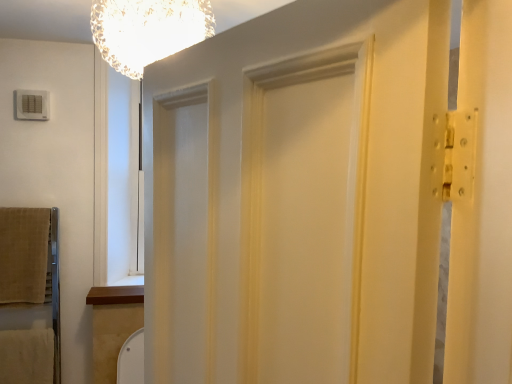
In order to click on beige soft towel at left in this screenshot , I will do `click(23, 254)`.

Where is `white painted wood barn door at center`? Image resolution: width=512 pixels, height=384 pixels. white painted wood barn door at center is located at coordinates (297, 197).

Can you confirm if beige soft towel at left is thinner than translucent glass chandelier at upper center?

Yes, beige soft towel at left is thinner than translucent glass chandelier at upper center.

Is beige soft towel at left not near translucent glass chandelier at upper center?

Absolutely, beige soft towel at left is distant from translucent glass chandelier at upper center.

What's the angular difference between beige soft towel at left and translucent glass chandelier at upper center's facing directions?

beige soft towel at left and translucent glass chandelier at upper center are facing 1.2 degrees away from each other.

From a real-world perspective, is beige soft towel at left under translucent glass chandelier at upper center?

Correct, in the physical world, beige soft towel at left is lower than translucent glass chandelier at upper center.

From a real-world perspective, is translucent glass chandelier at upper center located beneath white painted wood barn door at center?

No, from a real-world perspective, translucent glass chandelier at upper center is not beneath white painted wood barn door at center.

Considering the sizes of translucent glass chandelier at upper center and white painted wood barn door at center in the image, is translucent glass chandelier at upper center wider or thinner than white painted wood barn door at center?

Considering their sizes, translucent glass chandelier at upper center looks broader than white painted wood barn door at center.

Is translucent glass chandelier at upper center touching white painted wood barn door at center?

There is a gap between translucent glass chandelier at upper center and white painted wood barn door at center.

Considering the sizes of white painted wood barn door at center and translucent glass chandelier at upper center in the image, is white painted wood barn door at center wider or thinner than translucent glass chandelier at upper center?

Clearly, white painted wood barn door at center has less width compared to translucent glass chandelier at upper center.

From a real-world perspective, is white painted wood barn door at center on top of translucent glass chandelier at upper center?

No, from a real-world perspective, white painted wood barn door at center is not over translucent glass chandelier at upper center

From the image's perspective, which is above, white painted wood barn door at center or translucent glass chandelier at upper center?

translucent glass chandelier at upper center.

Which object is further away from the camera taking this photo, white painted wood barn door at center or translucent glass chandelier at upper center?

Positioned behind is translucent glass chandelier at upper center.

Could you tell me if translucent glass chandelier at upper center is turned towards beige soft towel at left?

No, translucent glass chandelier at upper center is not aimed at beige soft towel at left.

Between translucent glass chandelier at upper center and beige soft towel at left, which one has more height?

beige soft towel at left.

Is the depth of translucent glass chandelier at upper center less than that of beige soft towel at left?

Yes, it is in front of beige soft towel at left.

From a real-world perspective, between white painted wood barn door at center and beige soft towel at left, who is vertically higher?

From a 3D spatial view, white painted wood barn door at center is above.

Is white painted wood barn door at center in front of or behind beige soft towel at left in the image?

Clearly, white painted wood barn door at center is in front of beige soft towel at left.

From the picture: Considering the relative sizes of white painted wood barn door at center and beige soft towel at left in the image provided, is white painted wood barn door at center taller than beige soft towel at left?

Indeed, white painted wood barn door at center has a greater height compared to beige soft towel at left.

Looking at this image, are white painted wood barn door at center and beige soft towel at left far apart?

white painted wood barn door at center is far away from beige soft towel at left.

Is beige soft towel at left not within white painted wood barn door at center?

Yes, beige soft towel at left is outside of white painted wood barn door at center.

Image resolution: width=512 pixels, height=384 pixels. What are the coordinates of `barn door located in front of the beige soft towel at left` in the screenshot? It's located at (297, 197).

Is beige soft towel at left wider or thinner than white painted wood barn door at center?

Considering their sizes, beige soft towel at left looks slimmer than white painted wood barn door at center.

From a real-world perspective, is beige soft towel at left over white painted wood barn door at center?

No, from a real-world perspective, beige soft towel at left is not above white painted wood barn door at center.

Find the location of a particular element. The image size is (512, 384). light fixture above the beige soft towel at left (from the image's perspective) is located at coordinates click(147, 30).

Locate an element on the screen. light fixture on the left of white painted wood barn door at center is located at coordinates (147, 30).

When comparing their distances from translucent glass chandelier at upper center, does white painted wood barn door at center or beige soft towel at left seem closer?

Among the two, white painted wood barn door at center is located nearer to translucent glass chandelier at upper center.

When comparing their distances from beige soft towel at left, does translucent glass chandelier at upper center or white painted wood barn door at center seem further?

white painted wood barn door at center.

From the image, which object appears to be farther from beige soft towel at left, white painted wood barn door at center or translucent glass chandelier at upper center?

white painted wood barn door at center lies further to beige soft towel at left than the other object.

Estimate the real-world distances between objects in this image. Which object is further from white painted wood barn door at center, beige soft towel at left or translucent glass chandelier at upper center?

beige soft towel at left is positioned further to the anchor white painted wood barn door at center.

Which object lies nearer to the anchor point white painted wood barn door at center, translucent glass chandelier at upper center or beige soft towel at left?

The object closer to white painted wood barn door at center is translucent glass chandelier at upper center.

From the image, which object appears to be farther from translucent glass chandelier at upper center, beige soft towel at left or white painted wood barn door at center?

Among the two, beige soft towel at left is located further to translucent glass chandelier at upper center.

In order to click on light fixture positioned between white painted wood barn door at center and beige soft towel at left from near to far in this screenshot , I will do `click(147, 30)`.